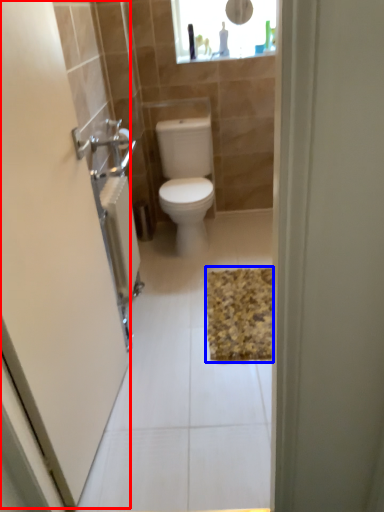
Question: Which point is further to the camera, screen door (highlighted by a red box) or bath mat (highlighted by a blue box)?

Choices:
 (A) screen door
 (B) bath mat

Answer: (B)